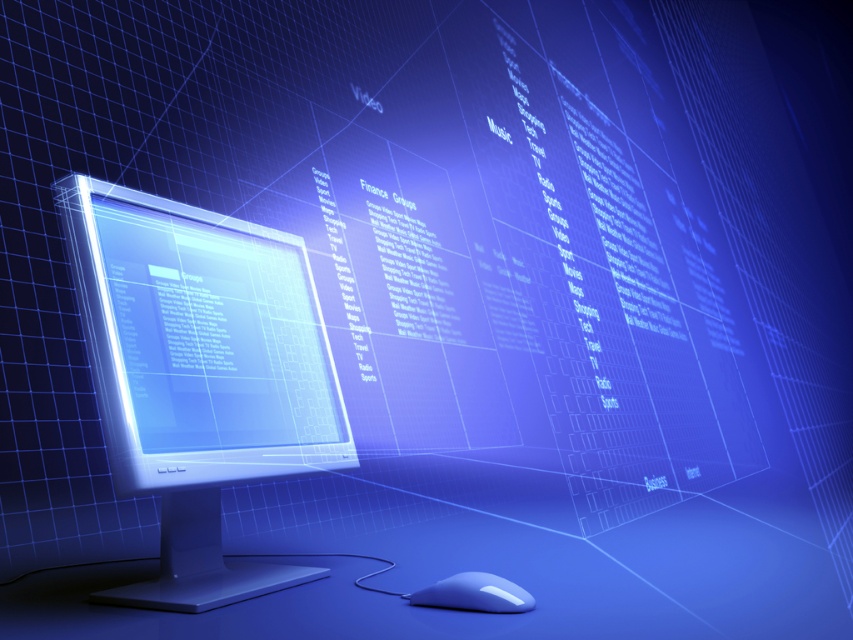
You are using the satin silver monitor at center and want to click the mouse. Where should you move your hand relative to the monitor to reach the white glossy mouse at lower center?

The white glossy mouse at lower center is located below the satin silver monitor at center, so you should move your hand downward from the monitor to reach it.

You are designing a layout for a tech exhibition booth and need to place a label for the satin silver monitor at center. According to the coordinates provided, where should you position the label relative to the monitor?

The label should be positioned at point (x=200, y=374) relative to the satin silver monitor at center as per the coordinates given.

You are using the satin silver monitor at center and need to reach the white glossy mouse at lower center. Is the mouse within easy reach from your current position?

The white glossy mouse at lower center is behind the satin silver monitor at center, so it might be difficult to reach from your current position.